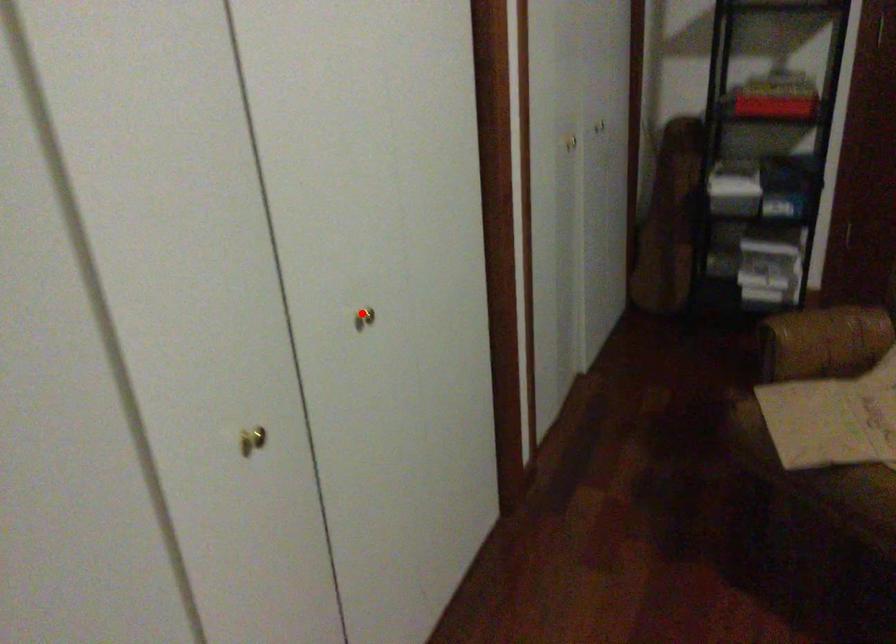
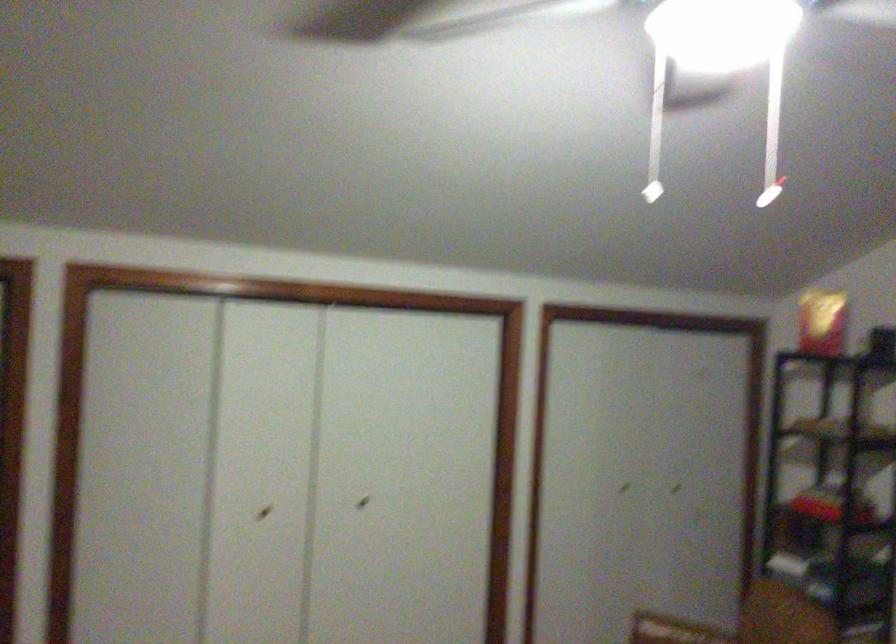
The point at the highlighted location is marked in the first image. Where is the corresponding point in the second image?

(363, 502)